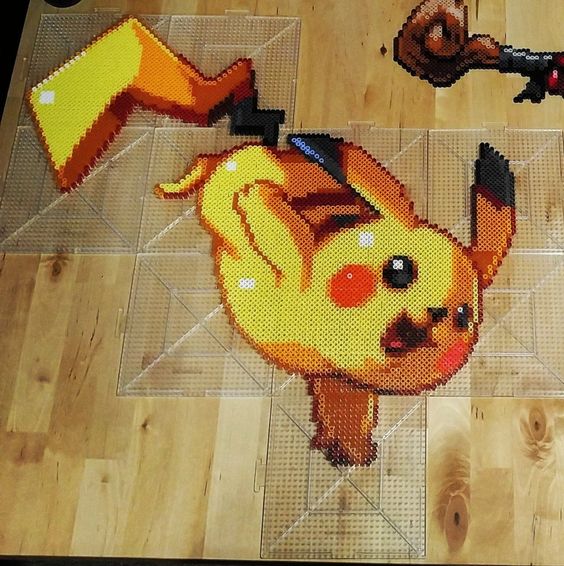
At what (x,y) coordinates should I click in order to perform the action: click on puzzle mat piece. Please return your answer as a coordinate pair (x, y). Looking at the image, I should click on (383, 493), (514, 353), (369, 315), (206, 357), (226, 192), (385, 184), (517, 204), (243, 58), (101, 190), (101, 54).